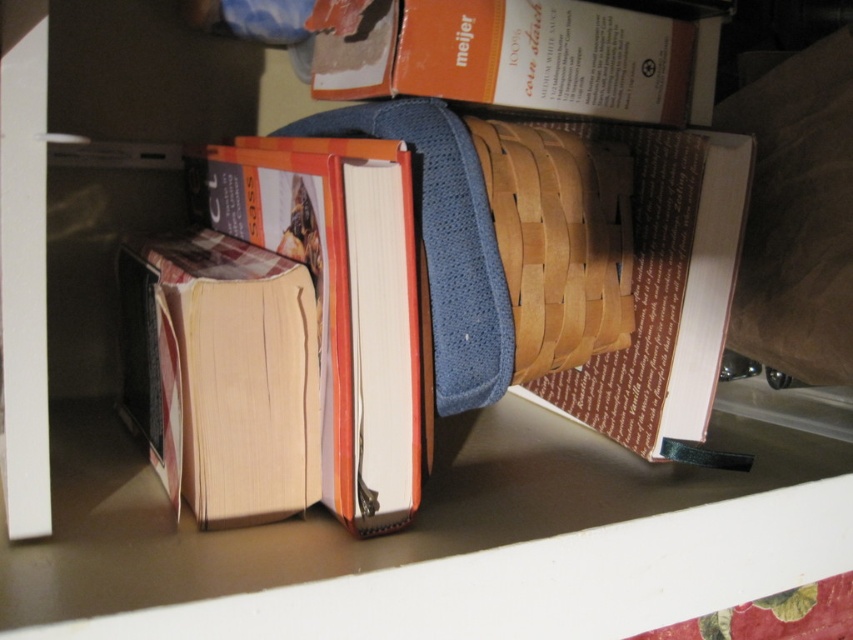
In the scene shown: You have a small toy car that is 3.5 inches long. You want to place it between the orange cardboard box at upper center and the natural wood basket at center on the shelf. Will it fit without overlapping either object?

The orange cardboard box at upper center and natural wood basket at center are 4.08 inches apart. Since the toy car is 3.5 inches long, it will fit between them without overlapping either object because 3.5 inches is less than the 4.08 inches of available space.

You are a delivery person who needs to place a new package that is 55 centimeters long onto the shelf. The package must be placed in a spot that is closest to the camera. Is there enough space for the package next to the orange cardboard box at upper center?

The orange cardboard box at upper center is 56.47 centimeters away from the camera. Since the package is 55 centimeters long, it can be placed next to the orange cardboard box at upper center as there is sufficient space between the box and the camera.

Based on the photo, you are organizing the items on the shelf and need to place a new item between the beige paper at center and the orange cardboard box at upper center. Based on their current positions, which object should you move to the right to create space?

You should move the beige paper at center to the right since it is currently on the left side of the orange cardboard box at upper center, allowing space for the new item between them.